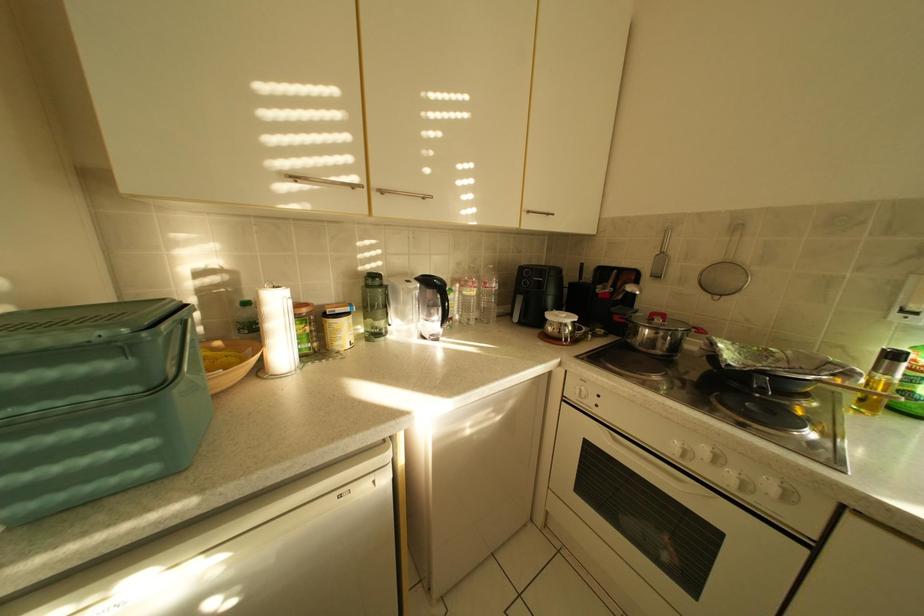
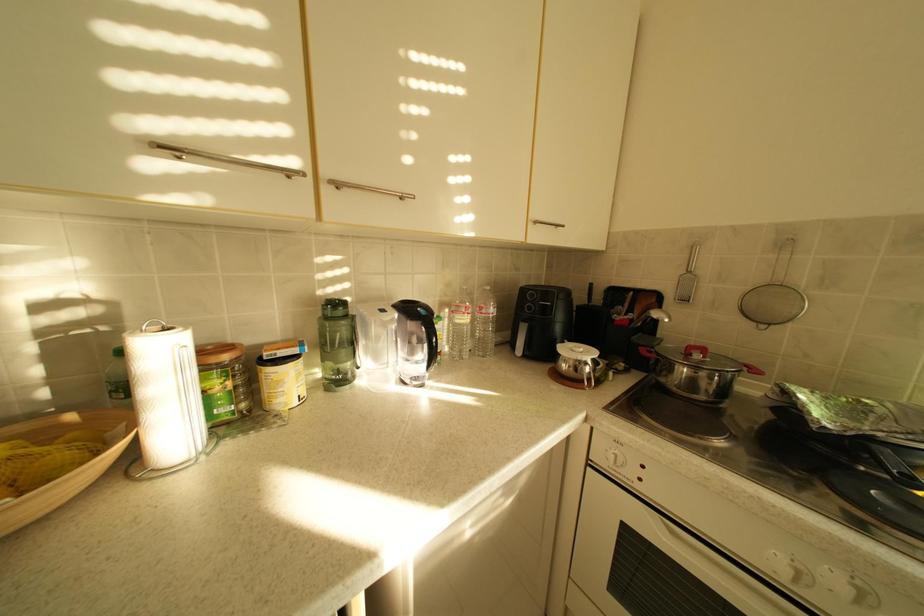
Question: The camera is either moving clockwise (left) or counter-clockwise (right) around the object. The first image is from the beginning of the video and the second image is from the end. Is the camera moving left or right when shooting the video?

Choices:
 (A) Left
 (B) Right

Answer: (A)